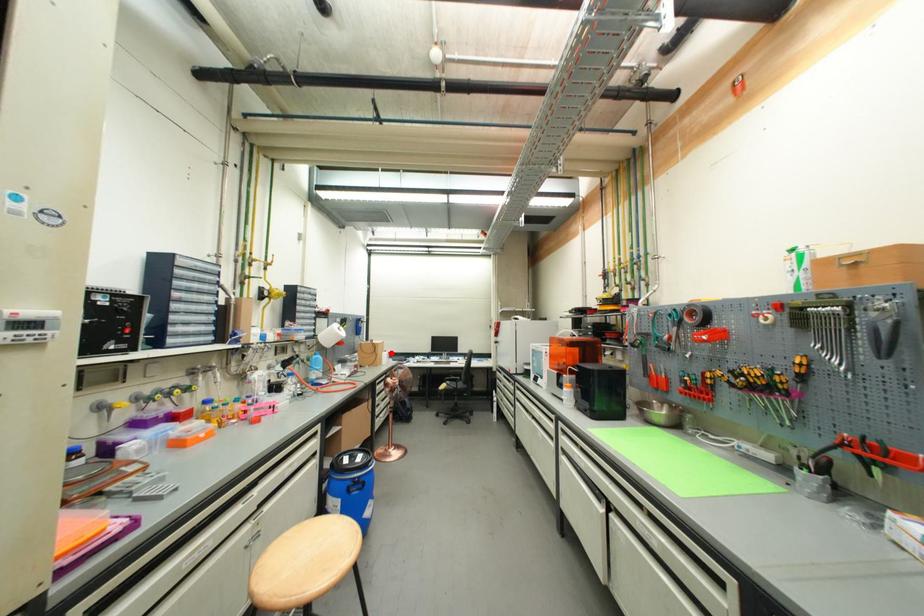
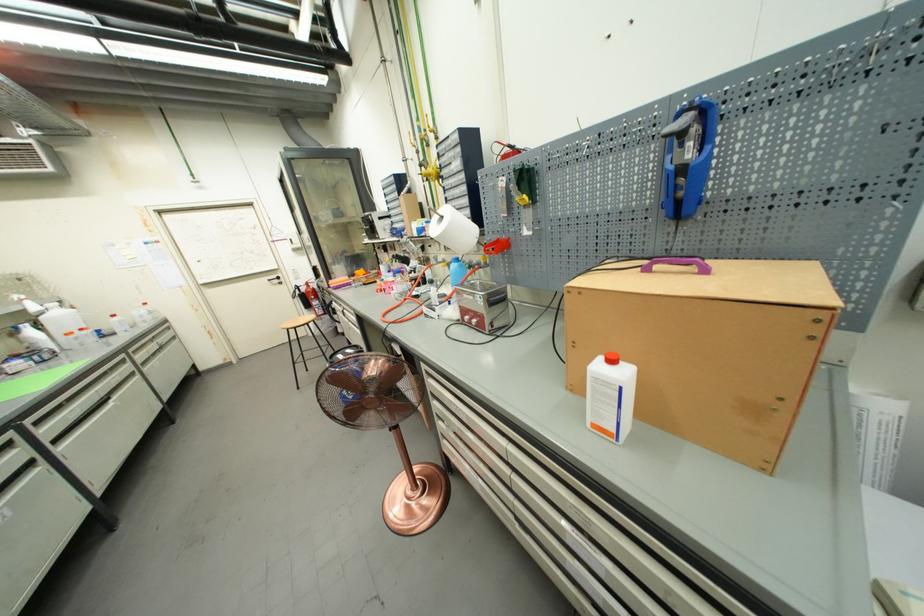
Where in the second image is the point corresponding to the highlighted location from the first image?

(617, 363)